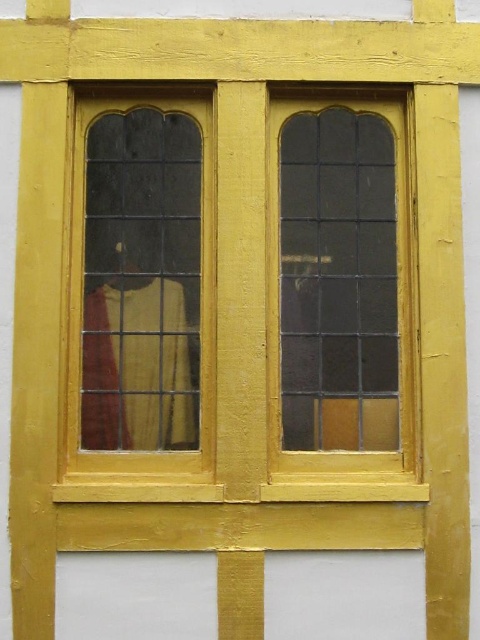
Question: Can you confirm if stained glass window at center is positioned to the right of clear glass window at left?

Choices:
 (A) yes
 (B) no

Answer: (A)

Question: Can you confirm if stained glass window at center is wider than clear glass window at left?

Choices:
 (A) yes
 (B) no

Answer: (A)

Question: Is stained glass window at center bigger than clear glass window at left?

Choices:
 (A) no
 (B) yes

Answer: (B)

Question: Among these points, which one is nearest to the camera?

Choices:
 (A) click(x=179, y=272)
 (B) click(x=297, y=410)

Answer: (B)